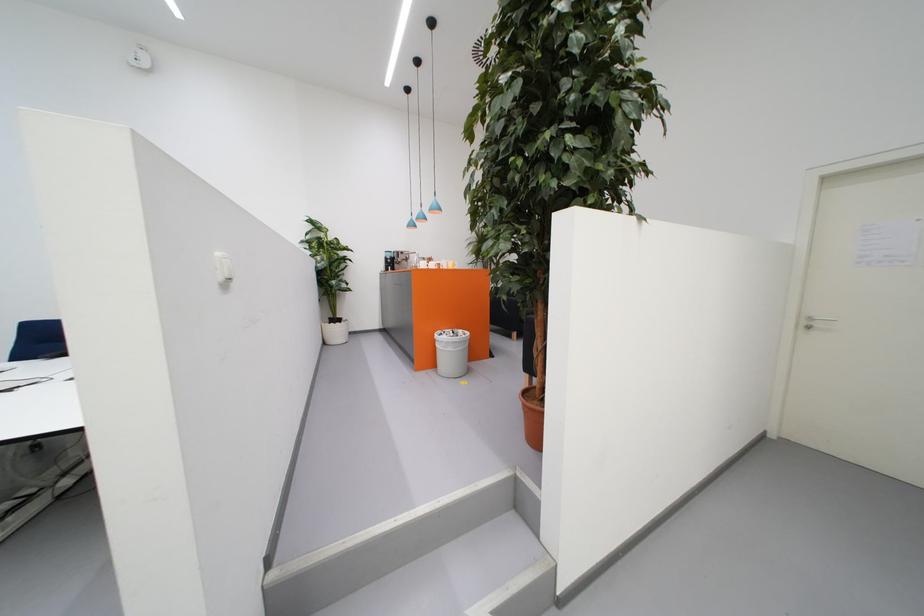
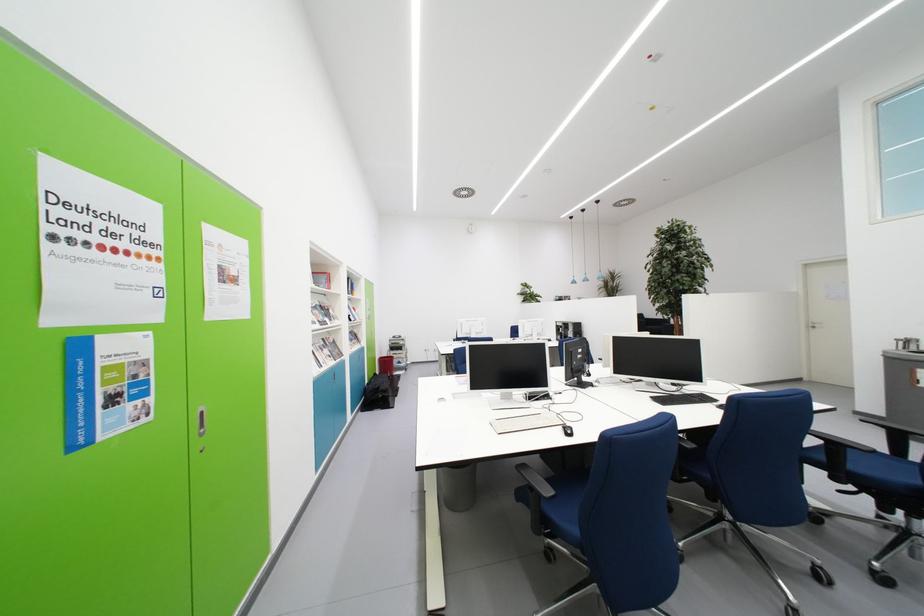
Question: I am providing you with two images of the same scene from different viewpoints. After the viewpoint changes to image2, which objects are now occluded?

Choices:
 (A) black chair armrest
 (B) blue rolled-up mat
 (C) coffee machine lever
 (D) book on shelf

Answer: (C)